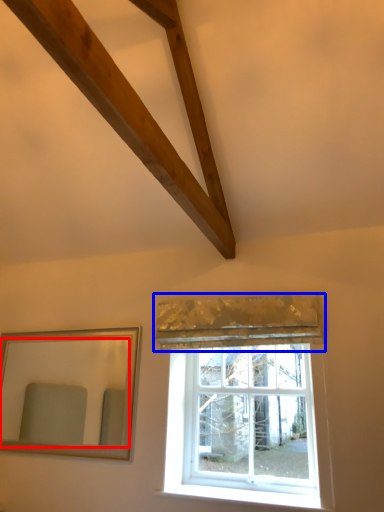
Question: Which object appears closest to the camera in this image, mirror (highlighted by a red box) or curtain (highlighted by a blue box)?

Choices:
 (A) mirror
 (B) curtain

Answer: (B)